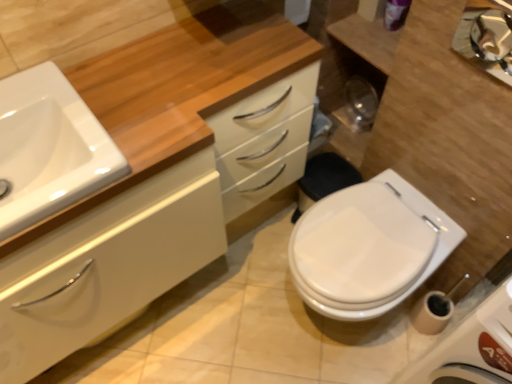
Question: Does metallic reflective mirror at upper right have a smaller size compared to white glossy sink at left?

Choices:
 (A) no
 (B) yes

Answer: (B)

Question: Are metallic reflective mirror at upper right and white glossy sink at left beside each other?

Choices:
 (A) no
 (B) yes

Answer: (A)

Question: Can you confirm if metallic reflective mirror at upper right is thinner than white glossy sink at left?

Choices:
 (A) yes
 (B) no

Answer: (A)

Question: Considering the relative sizes of metallic reflective mirror at upper right and white glossy sink at left in the image provided, is metallic reflective mirror at upper right bigger than white glossy sink at left?

Choices:
 (A) yes
 (B) no

Answer: (B)

Question: Is metallic reflective mirror at upper right positioned behind white glossy sink at left?

Choices:
 (A) no
 (B) yes

Answer: (B)

Question: Is metallic reflective mirror at upper right wider than white glossy sink at left?

Choices:
 (A) yes
 (B) no

Answer: (B)

Question: Can you confirm if white glossy toilet at lower right is positioned to the left of metallic reflective mirror at upper right?

Choices:
 (A) yes
 (B) no

Answer: (A)

Question: Would you say white glossy toilet at lower right contains metallic reflective mirror at upper right?

Choices:
 (A) no
 (B) yes

Answer: (A)

Question: Does white glossy toilet at lower right lie in front of metallic reflective mirror at upper right?

Choices:
 (A) yes
 (B) no

Answer: (B)

Question: Is white glossy toilet at lower right shorter than metallic reflective mirror at upper right?

Choices:
 (A) yes
 (B) no

Answer: (B)

Question: Are white glossy toilet at lower right and metallic reflective mirror at upper right making contact?

Choices:
 (A) no
 (B) yes

Answer: (A)

Question: From a real-world perspective, is white glossy toilet at lower right under metallic reflective mirror at upper right?

Choices:
 (A) yes
 (B) no

Answer: (A)

Question: From the image's perspective, is metallic reflective mirror at upper right over white glossy cabinet at center?

Choices:
 (A) no
 (B) yes

Answer: (B)